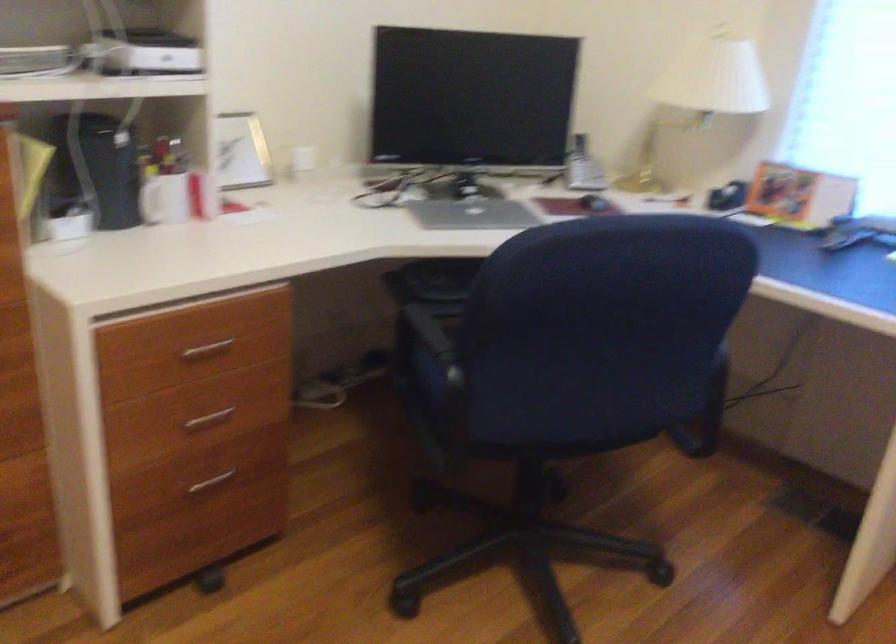
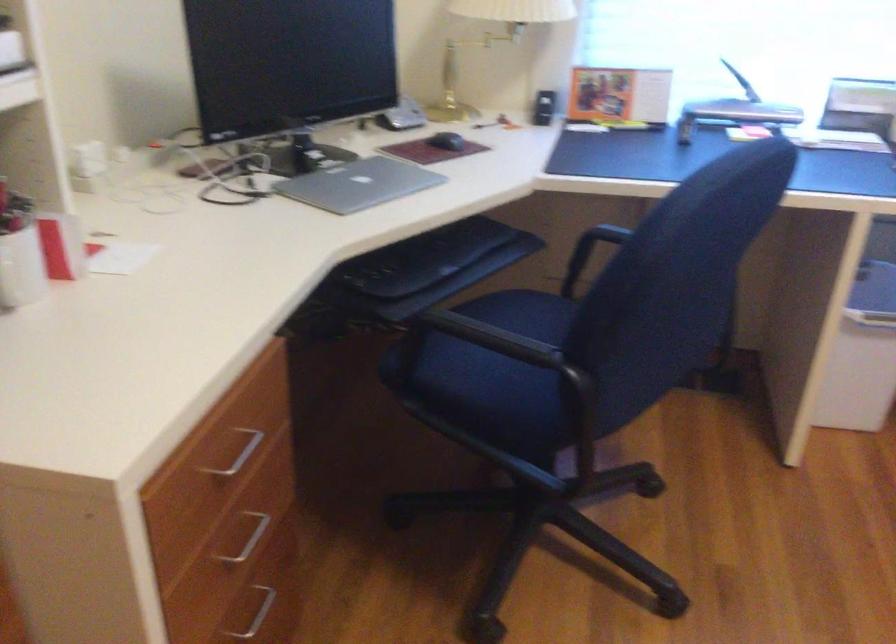
Where in the second image is the point corresponding to point 462,212 from the first image?

(358, 184)